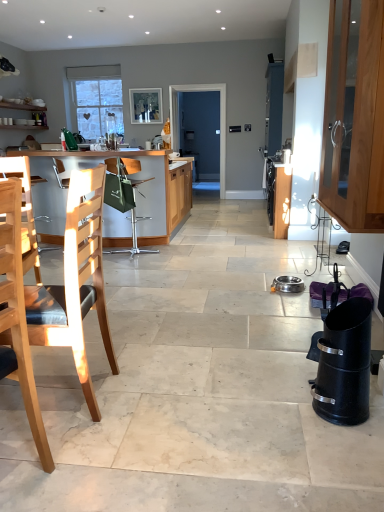
Question: Is wooden cabinet at right far away from green fabric chair at center, which appears as the third chair when viewed from the front?

Choices:
 (A) no
 (B) yes

Answer: (B)

Question: From the image's perspective, would you say wooden cabinet at right is positioned over green fabric chair at center, which appears as the third chair when viewed from the front?

Choices:
 (A) no
 (B) yes

Answer: (B)

Question: Can you confirm if wooden cabinet at right is wider than green fabric chair at center, the first chair from the back?

Choices:
 (A) yes
 (B) no

Answer: (B)

Question: Is wooden cabinet at right touching green fabric chair at center, which appears as the third chair when viewed from the front?

Choices:
 (A) no
 (B) yes

Answer: (A)

Question: Can you confirm if wooden cabinet at right is taller than green fabric chair at center, which appears as the third chair when viewed from the front?

Choices:
 (A) no
 (B) yes

Answer: (B)

Question: From a real-world perspective, is wooden cabinet at right over green fabric chair at center, the first chair from the back?

Choices:
 (A) yes
 (B) no

Answer: (A)

Question: From a real-world perspective, is blue matte screen door at center on light wood chair at left, the second chair viewed from the back?

Choices:
 (A) no
 (B) yes

Answer: (B)

Question: From the image's perspective, does blue matte screen door at center appear higher than light wood chair at left, the second chair viewed from the back?

Choices:
 (A) no
 (B) yes

Answer: (B)

Question: Is blue matte screen door at center oriented towards light wood chair at left, the second chair viewed from the back?

Choices:
 (A) yes
 (B) no

Answer: (A)

Question: Does blue matte screen door at center lie in front of light wood chair at left, which is counted as the 2th chair, starting from the front?

Choices:
 (A) no
 (B) yes

Answer: (A)

Question: Is blue matte screen door at center beside light wood chair at left, which is counted as the 2th chair, starting from the front?

Choices:
 (A) no
 (B) yes

Answer: (A)

Question: Considering the relative positions of blue matte screen door at center and light wood chair at left, the second chair viewed from the back, in the image provided, is blue matte screen door at center to the left of light wood chair at left, the second chair viewed from the back, from the viewer's perspective?

Choices:
 (A) no
 (B) yes

Answer: (A)

Question: Is light wood chair at left, marked as the first chair in a front-to-back arrangement, far from black matte trash can at lower right, the second appliance from the back?

Choices:
 (A) no
 (B) yes

Answer: (B)